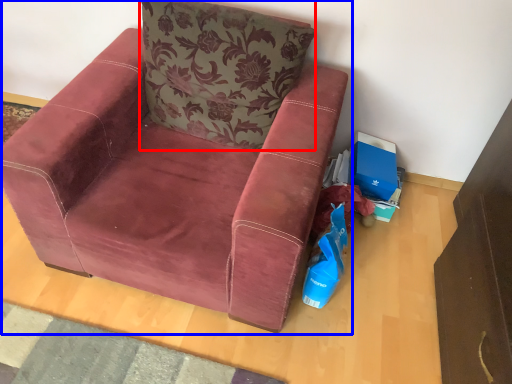
Question: Which of the following is the closest to the observer, pillow (highlighted by a red box) or chair (highlighted by a blue box)?

Choices:
 (A) pillow
 (B) chair

Answer: (B)